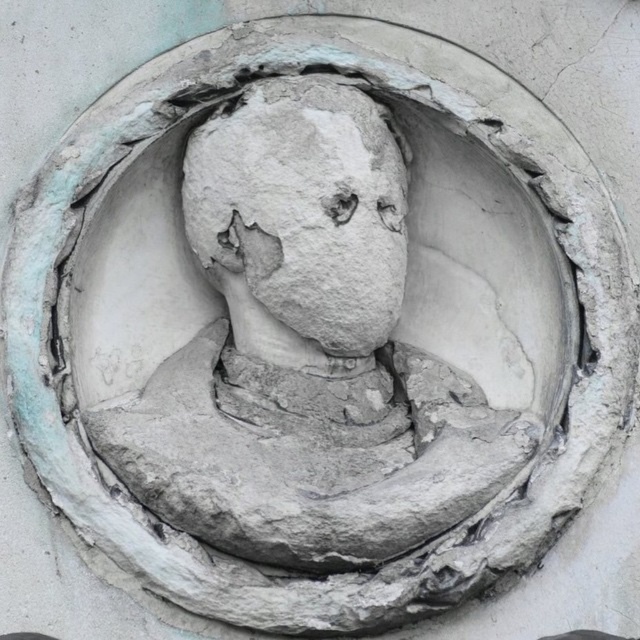
Is white stone bust at center bigger than gray stone face at center?

Indeed, white stone bust at center has a larger size compared to gray stone face at center.

Is white stone bust at center to the right of gray stone face at center from the viewer's perspective?

Yes, white stone bust at center is to the right of gray stone face at center.

What do you see at coordinates (316, 326) in the screenshot? I see `white stone bust at center` at bounding box center [316, 326].

The width and height of the screenshot is (640, 640). Find the location of `white stone bust at center`. white stone bust at center is located at coordinates (316, 326).